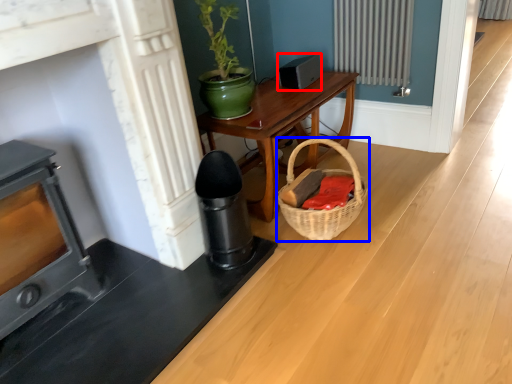
Question: Which of the following is the farthest to the observer, appliance (highlighted by a red box) or basket (highlighted by a blue box)?

Choices:
 (A) appliance
 (B) basket

Answer: (A)